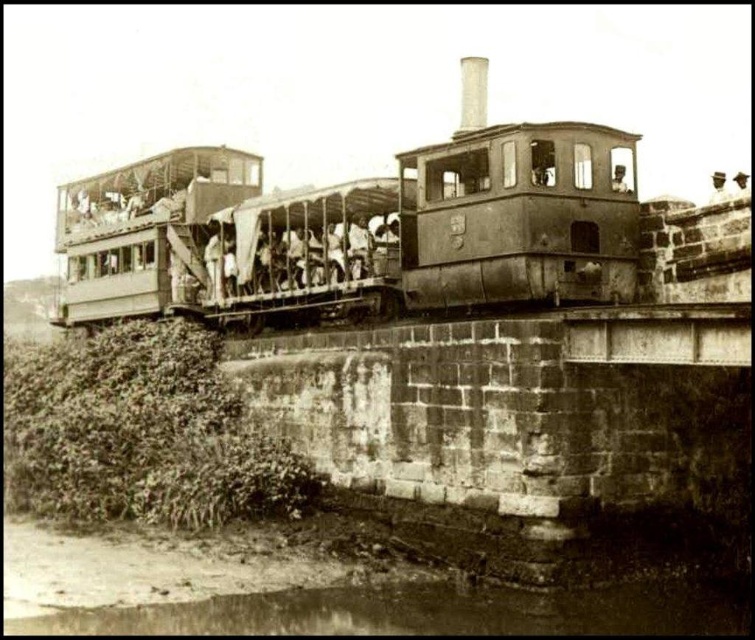
The image size is (755, 640). What do you see at coordinates (359, 227) in the screenshot?
I see `rusty metal train at center` at bounding box center [359, 227].

Is rusty metal train at center further to camera compared to brown dirt river at lower left?

Yes, rusty metal train at center is behind brown dirt river at lower left.

Which is in front, point (461, 161) or point (680, 596)?

Point (680, 596) is more forward.

At what (x,y) coordinates should I click in order to perform the action: click on rusty metal train at center. Please return your answer as a coordinate pair (x, y). This screenshot has width=755, height=640. Looking at the image, I should click on (359, 227).